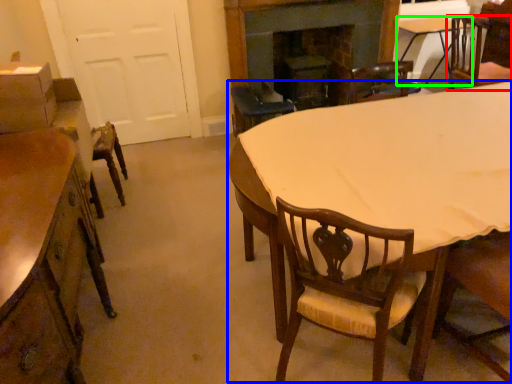
Question: Estimate the real-world distances between objects in this image. Which object is farther from chair (highlighted by a red box), kitchen & dining room table (highlighted by a blue box) or table (highlighted by a green box)?

Choices:
 (A) kitchen & dining room table
 (B) table

Answer: (A)